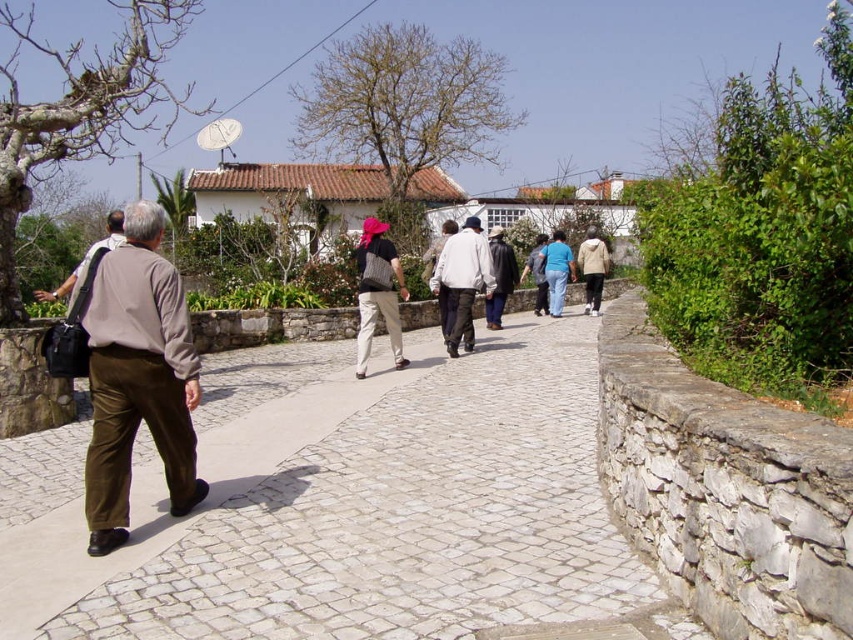
You are standing at the entrance of the cobblestone path and see the light gray fabric jacket at center. If you walk straight ahead, will you approach the jacket or move away from it?

The light gray fabric jacket at center is located at point (x=462, y=282), which is along the central area of the path. Since you are at the entrance and walking straight ahead, you will approach the jacket as you move towards the center of the path.

You are standing on the cobblestone path and notice the white stone pavement at center and the light gray fabric jacket at center. Which object is lower in height?

The white stone pavement at center has a lesser height compared to the light gray fabric jacket at center, so the white stone pavement at center is lower.